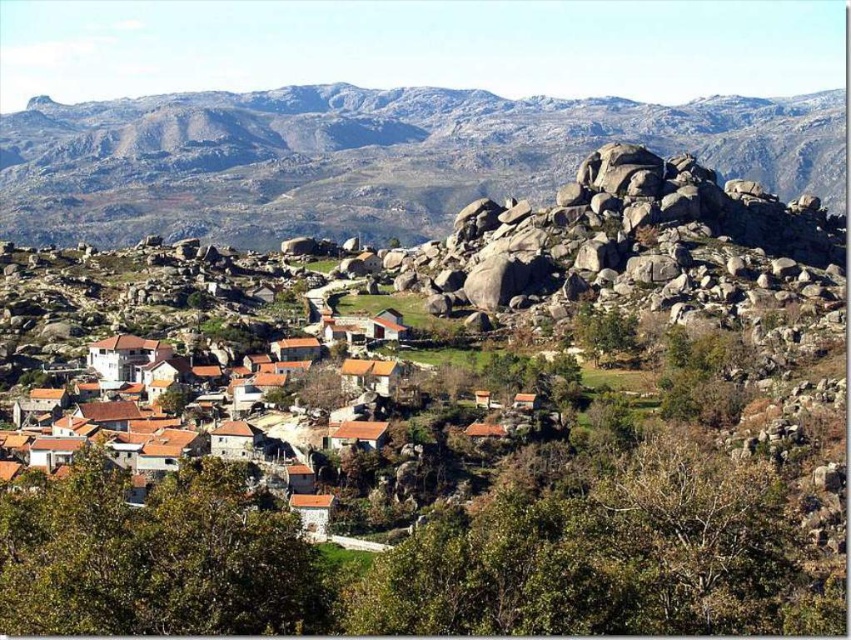
Is granite boulders at upper center above brown clay houses at center?

Yes, granite boulders at upper center is above brown clay houses at center.

Between granite boulders at upper center and brown clay houses at center, which one appears on the left side from the viewer's perspective?

Positioned to the left is brown clay houses at center.

Is point (587, 109) behind point (178, 452)?

Yes, it is behind point (178, 452).

Where is `granite boulders at upper center`? This screenshot has height=640, width=851. granite boulders at upper center is located at coordinates (367, 157).